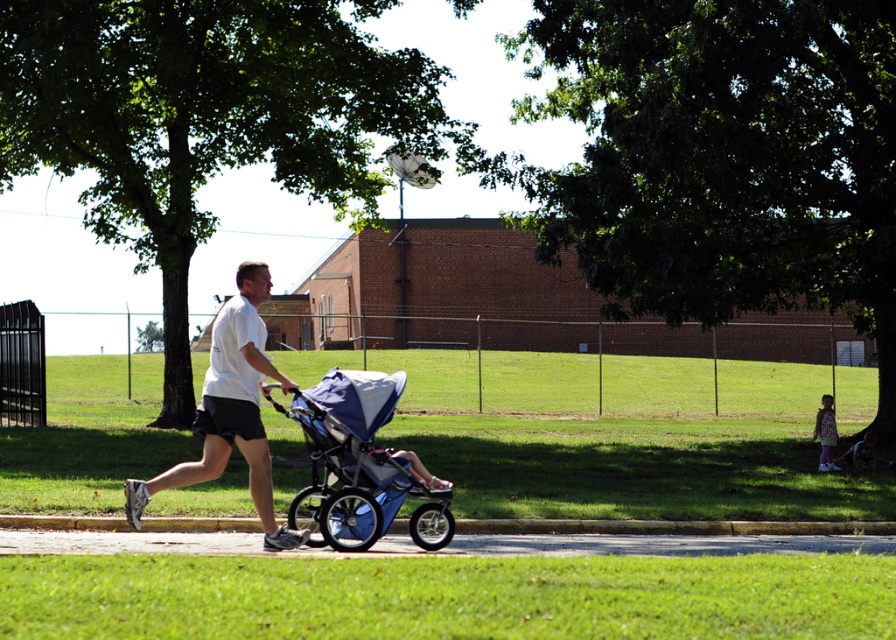
Question: Is white matte shirt at center below pastel pink dress at lower right?

Choices:
 (A) yes
 (B) no

Answer: (B)

Question: Considering the real-world distances, which object is closest to the white matte shirt at center?

Choices:
 (A) light blue fabric stroller at center
 (B) pastel pink dress at lower right

Answer: (A)

Question: Estimate the real-world distances between objects in this image. Which object is closer to the white matte shirt at center?

Choices:
 (A) light blue fabric stroller at center
 (B) pastel pink dress at lower right

Answer: (A)

Question: Does blue fabric stroller at center appear on the right side of white matte shirt at center?

Choices:
 (A) yes
 (B) no

Answer: (A)

Question: Is blue fabric stroller at center behind pastel pink dress at lower right?

Choices:
 (A) no
 (B) yes

Answer: (A)

Question: Which object is farther from the camera taking this photo?

Choices:
 (A) pastel pink dress at lower right
 (B) light blue fabric stroller at center
 (C) blue fabric stroller at center

Answer: (A)